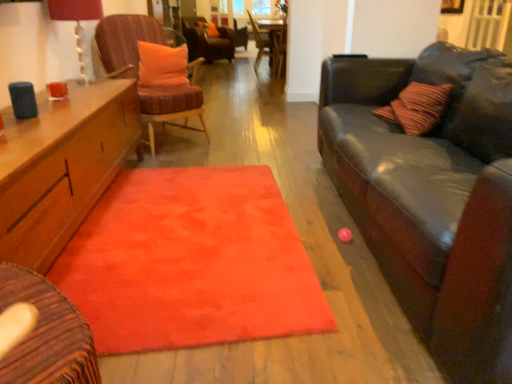
Question: From a real-world perspective, is matte glass lampshade at upper left physically located above or below orange fabric pillow at upper center, which is the 2th pillow in top-to-bottom order?

Choices:
 (A) above
 (B) below

Answer: (A)

Question: Is matte glass lampshade at upper left spatially inside orange fabric pillow at upper center, placed as the 1th pillow when sorted from bottom to top, or outside of it?

Choices:
 (A) outside
 (B) inside

Answer: (A)

Question: Estimate the real-world distances between objects in this image. Which object is farther from the velvet brown armchair at center?

Choices:
 (A) matte glass lampshade at upper left
 (B) wooden table at center
 (C) velvet orange chair at center, the first chair positioned from the back
 (D) wooden chair at center, the 2th chair in the back-to-front sequence
 (E) fluffy orange rug at center

Answer: (E)

Question: Considering the real-world distances, which object is farthest from the velvet brown armchair at center?

Choices:
 (A) wooden chair at center, the 2th chair positioned from the bottom
 (B) wooden table at center
 (C) velvet orange chair at center, which is the third chair from bottom to top
 (D) orange fabric pillow at upper center, which is the 2th pillow in top-to-bottom order
 (E) matte glass lampshade at upper left

Answer: (E)